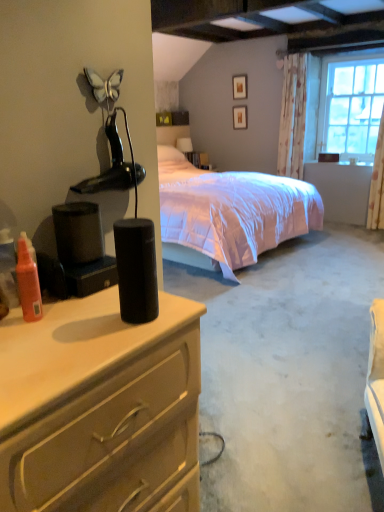
Where is `vacant space in front of black matte speaker at center`? vacant space in front of black matte speaker at center is located at coordinates (108, 346).